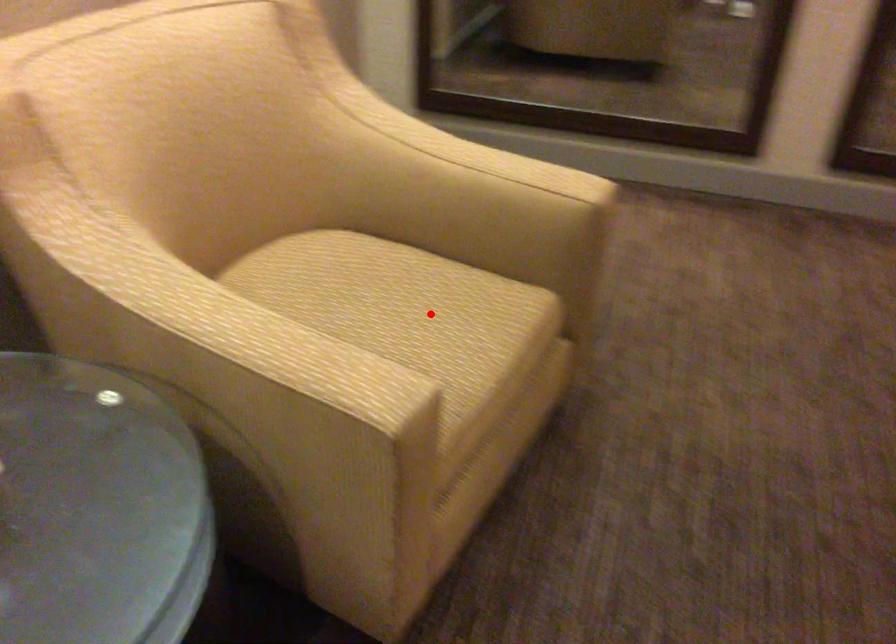
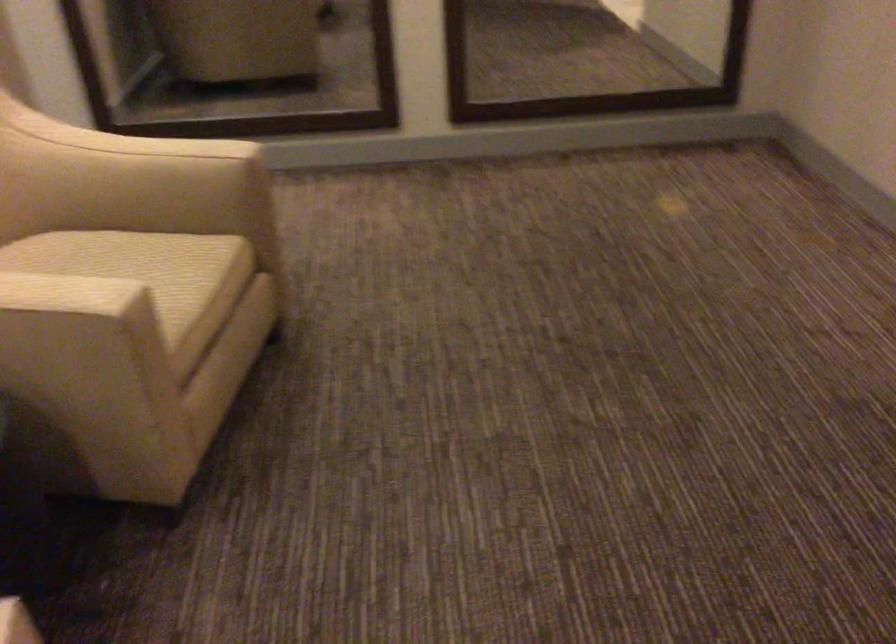
Where in the second image is the point corresponding to the highlighted location from the first image?

(143, 268)